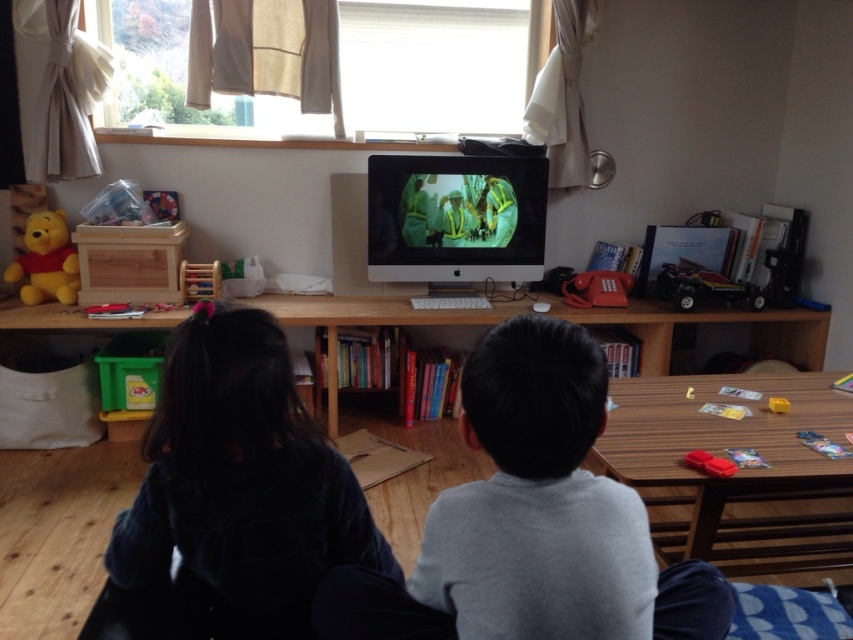
You are a parent who wants to place a new toy box between the wooden bookshelf at center and the matte yellow plush bear at left. The toy box is 1 meter in length. Will it fit without overlapping either object?

The wooden bookshelf at center is 1.06 meters away from the matte yellow plush bear at left. Since the toy box is 1 meter long, it will fit between them as there is enough space.

You are a parent trying to organize the playroom. The wooden bookshelf at center is currently at coordinates point 0.505, 0.834. If you want to move it closer to the window to utilize the natural light better, which direction should you move it?

The wooden bookshelf at center should be moved towards the window. Since the window is mentioned in the scene description as being in the background with beige curtains and greenery outside, moving the bookshelf towards the window would place it closer to the light source, optimizing natural light utilization.